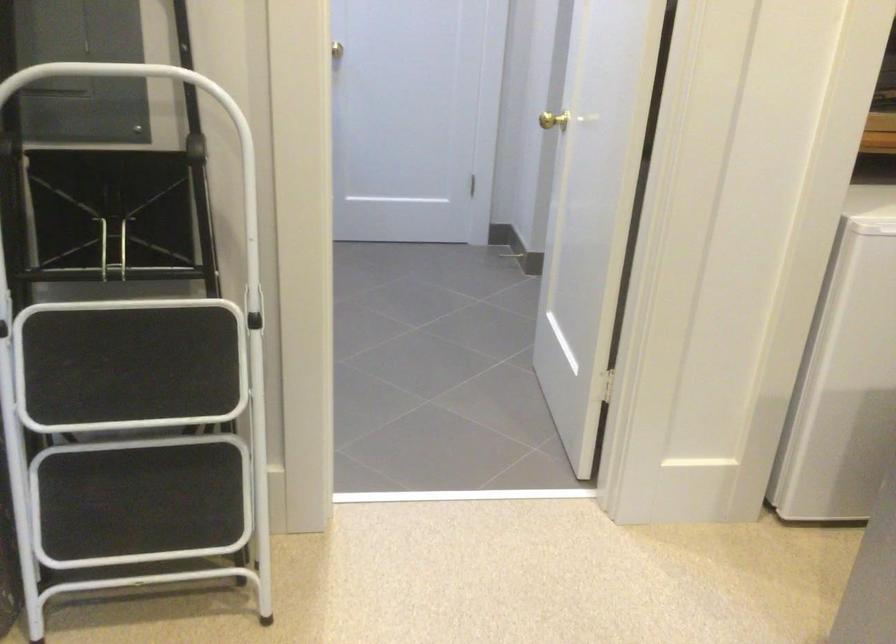
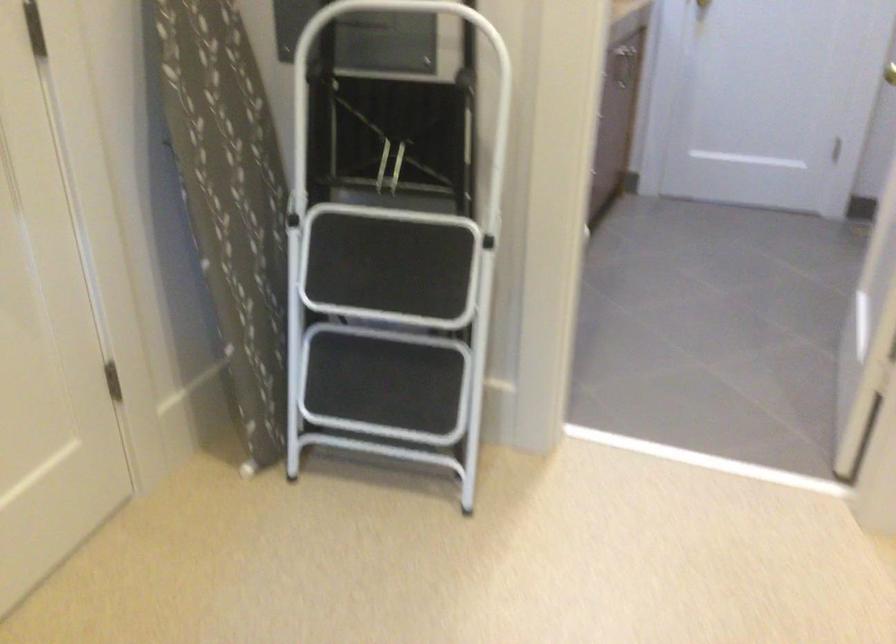
In the second image, find the point that corresponds to pixel 131 565 in the first image.

(380, 440)